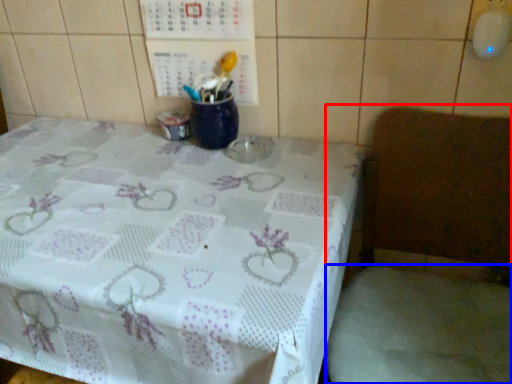
Question: Which object appears farthest to the camera in this image, chair (highlighted by a red box) or fabric (highlighted by a blue box)?

Choices:
 (A) chair
 (B) fabric

Answer: (B)